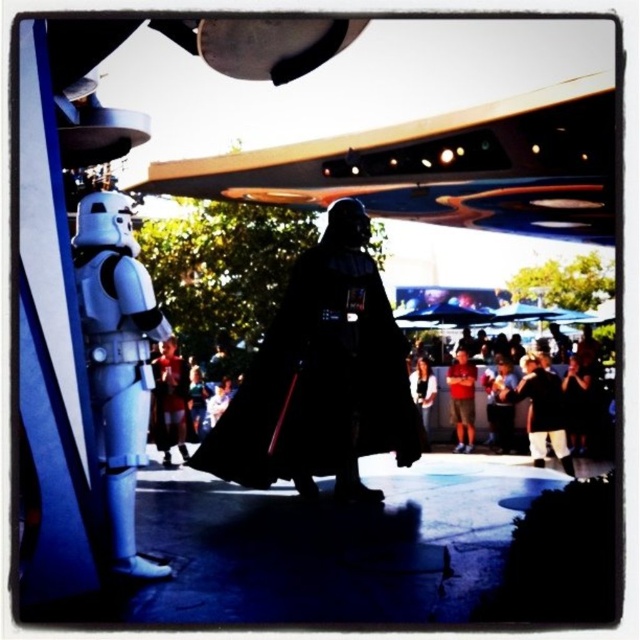
Measure the distance from white plastic stormtrooper at left to red cotton shirt at center.

They are 7.76 meters apart.

Is white plastic stormtrooper at left above red cotton shirt at center?

Correct, white plastic stormtrooper at left is located above red cotton shirt at center.

Where is `white plastic stormtrooper at left`? white plastic stormtrooper at left is located at coordinates (116, 358).

The image size is (640, 640). I want to click on white plastic stormtrooper at left, so click(x=116, y=358).

Which is more to the right, black matte cloak at center or orange shorts at center?

black matte cloak at center is more to the right.

Can you confirm if black matte cloak at center is positioned to the right of orange shorts at center?

Yes, black matte cloak at center is to the right of orange shorts at center.

Is point (371, 406) positioned before point (182, 401)?

Yes, it is.

What are the coordinates of `black matte cloak at center` in the screenshot? It's located at (320, 381).

Which of these two, red cotton shirt at center or white matte stormtrooper at center, stands shorter?

white matte stormtrooper at center

Does point (465, 364) lie behind point (420, 413)?

Yes, it is.

I want to click on red cotton shirt at center, so click(x=461, y=400).